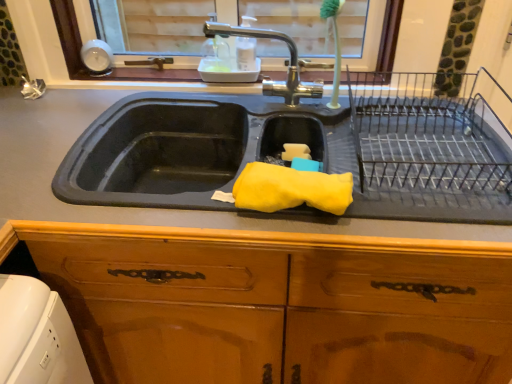
Question: Is polished chrome faucet at upper center taller or shorter than yellow sponge at sink?

Choices:
 (A) short
 (B) tall

Answer: (B)

Question: Based on their positions, is polished chrome faucet at upper center located to the left or right of yellow sponge at sink?

Choices:
 (A) right
 (B) left

Answer: (B)

Question: Considering the real-world distances, which object is closest to the yellow sponge at sink?

Choices:
 (A) wooden cabinet at center
 (B) polished chrome faucet at upper center
 (C) black wire rack at right
 (D) rubber yellow sponge at center

Answer: (D)

Question: Estimate the real-world distances between objects in this image. Which object is closer to the wooden cabinet at center?

Choices:
 (A) rubber yellow sponge at center
 (B) yellow sponge at sink
 (C) polished chrome faucet at upper center
 (D) black wire rack at right

Answer: (A)